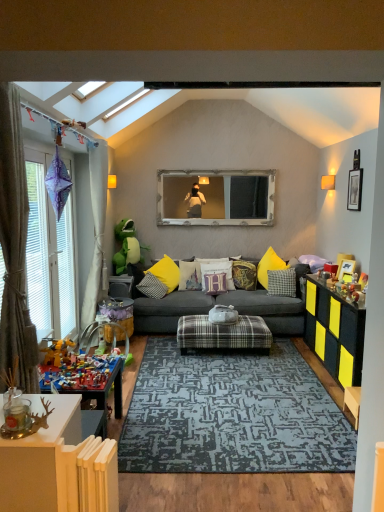
Question: Which is correct: yellow plastic toy at lower left, placed as the first toy when sorted from front to back, is inside black textured dresser at right, or outside of it?

Choices:
 (A) outside
 (B) inside

Answer: (A)

Question: In terms of height, does yellow plastic toy at lower left, placed as the 1th toy when sorted from bottom to top, look taller or shorter compared to black textured dresser at right?

Choices:
 (A) tall
 (B) short

Answer: (B)

Question: Estimate the real-world distances between objects in this image. Which object is closer to the white fabric curtain at left, the second curtain from the front?

Choices:
 (A) white wooden frame at center
 (B) white fabric pillow at center, which is the fourth pillow from left to right
 (C) wooden picture frame at right, the 2th picture frame in the top-to-bottom sequence
 (D) green plush toy at left, marked as the 2th toy in a front-to-back arrangement
 (E) white textured paper at left

Answer: (D)

Question: Which is nearer to the wooden picture frame at upper right, which appears as the 2th picture frame when viewed from the left?

Choices:
 (A) black textured dresser at right
 (B) green plush toy at left, marked as the 2th toy in a front-to-back arrangement
 (C) yellow fabric pillow at center, acting as the 6th pillow starting from the right
 (D) wooden picture frame at right, which is the 2th picture frame from right to left
 (E) white wooden frame at center

Answer: (D)